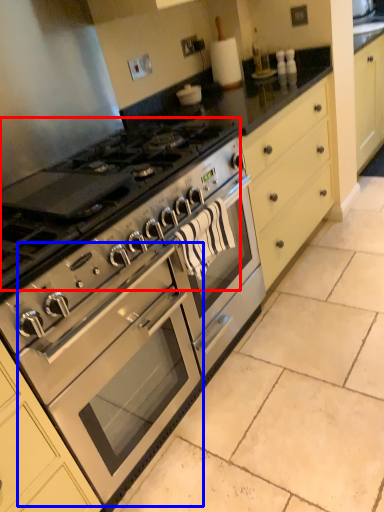
Question: Which point is further to the camera, gas stove (highlighted by a red box) or oven (highlighted by a blue box)?

Choices:
 (A) gas stove
 (B) oven

Answer: (B)